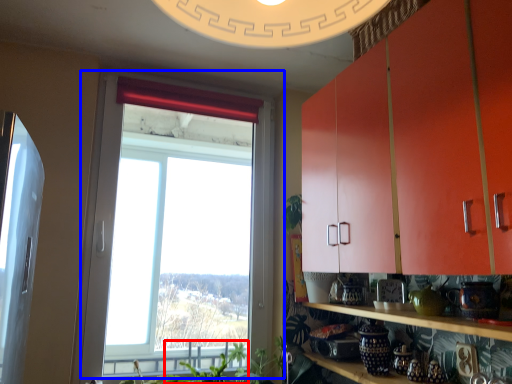
Question: Which point is closer to the camera, plant (highlighted by a red box) or window (highlighted by a blue box)?

Choices:
 (A) plant
 (B) window

Answer: (B)